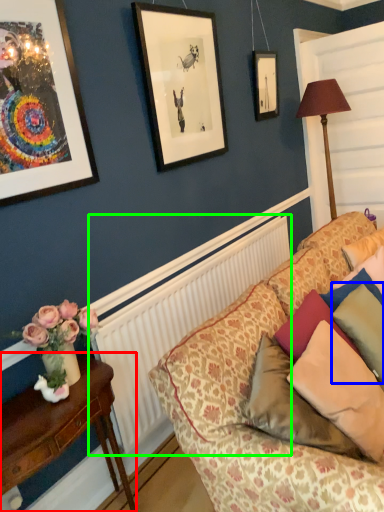
Question: Based on their relative distances, which object is farther from table (highlighted by a red box)? Choose from pillow (highlighted by a blue box) and radiator (highlighted by a green box).

Choices:
 (A) pillow
 (B) radiator

Answer: (A)